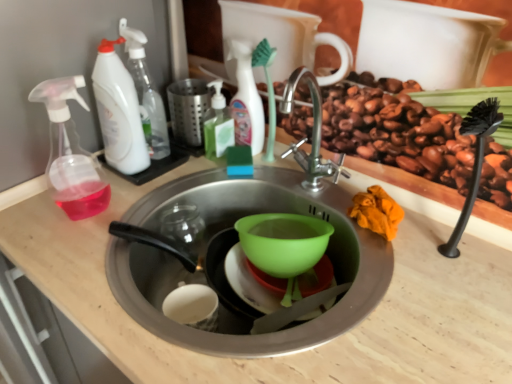
Locate an element on the screen. The image size is (512, 384). vacant space that is to the left of green liquid soap at upper center, acting as the 3th cleaning product starting from the left is located at coordinates (166, 163).